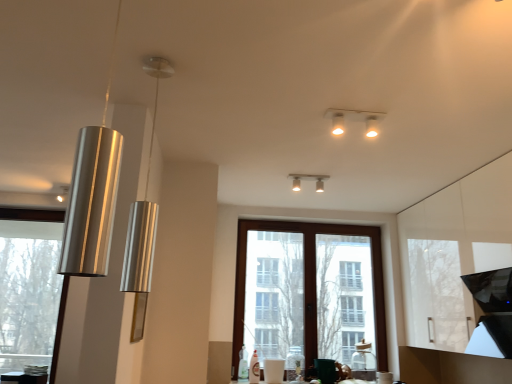
Where is `free spot above matte silver light fixture at upper center, the 4th lamp from the left (from a real-world perspective)`? free spot above matte silver light fixture at upper center, the 4th lamp from the left (from a real-world perspective) is located at coordinates (308, 175).